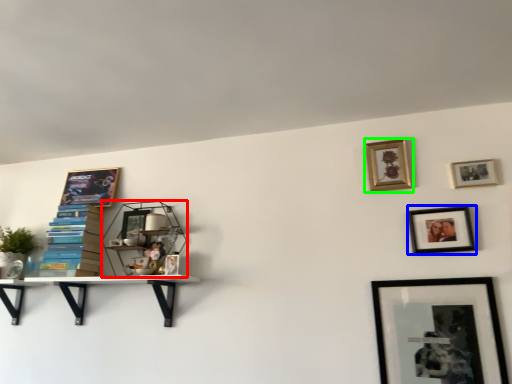
Question: Which object is the farthest from shelf (highlighted by a red box)? Choose among these: picture frame (highlighted by a blue box) or picture frame (highlighted by a green box).

Choices:
 (A) picture frame
 (B) picture frame

Answer: (A)